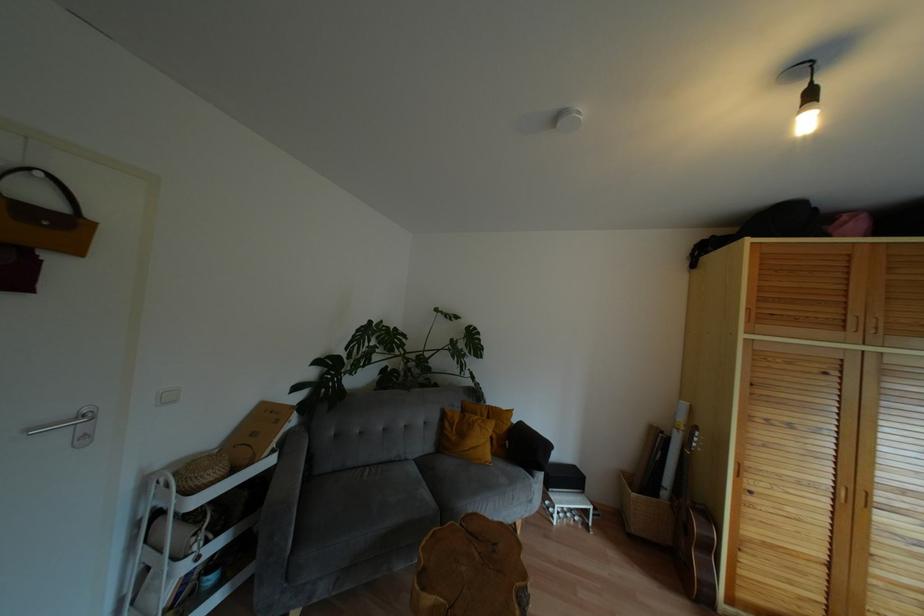
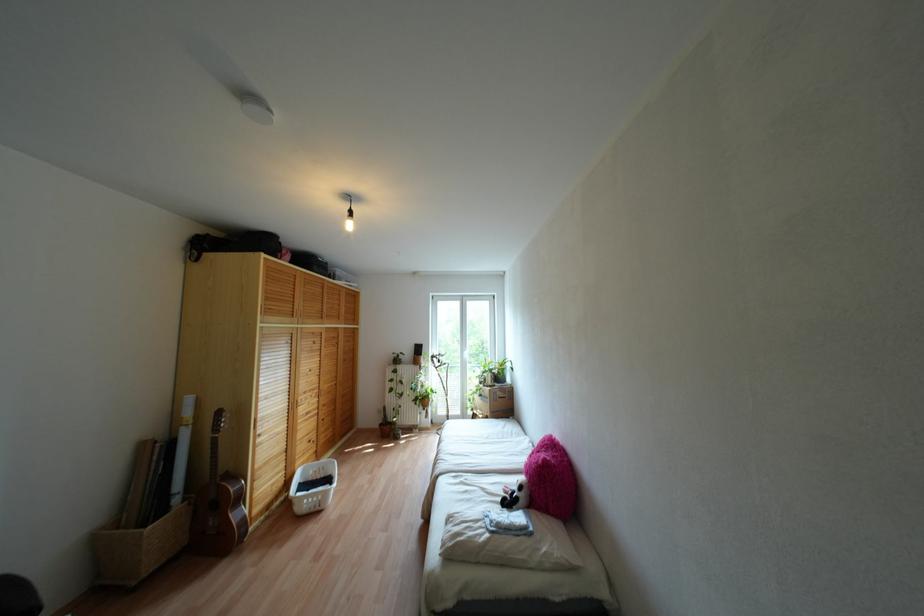
The point at (738,570) is marked in the first image. Where is the corresponding point in the second image?

(253, 495)